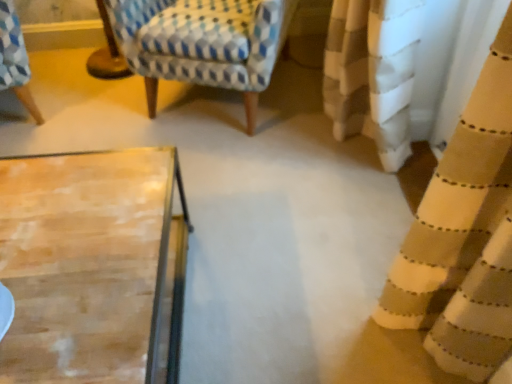
Where is `free location to the left of beige textured curtain at right`? The height and width of the screenshot is (384, 512). free location to the left of beige textured curtain at right is located at coordinates (319, 213).